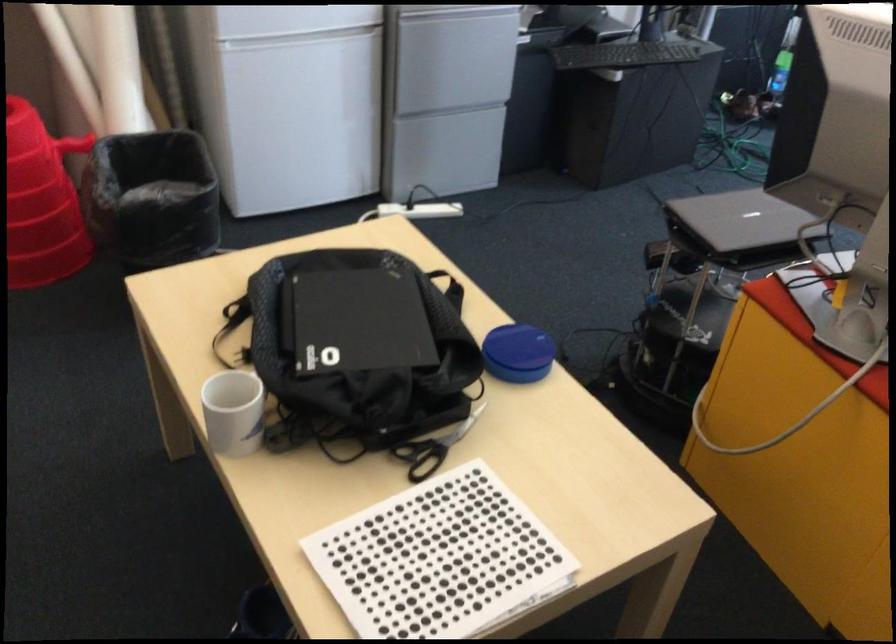
You are a GUI agent. You are given a task and a screenshot of the screen. Output one action in this format:
    pyautogui.click(x=<x>, y=<y>)
    Task: Click on the chair sitting surface
    
    Given the screenshot: What is the action you would take?
    736,252